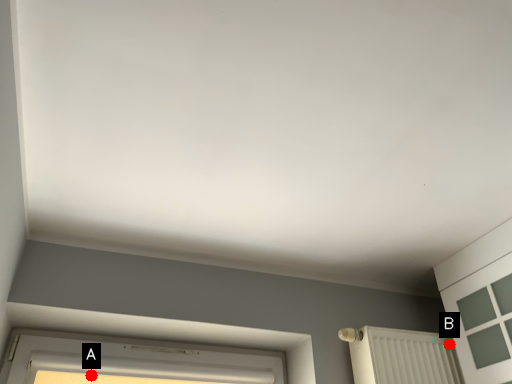
Question: Two points are circled on the image, labeled by A and B beside each circle. Which point appears farthest from the camera in this image?

Choices:
 (A) A is further
 (B) B is further

Answer: (B)